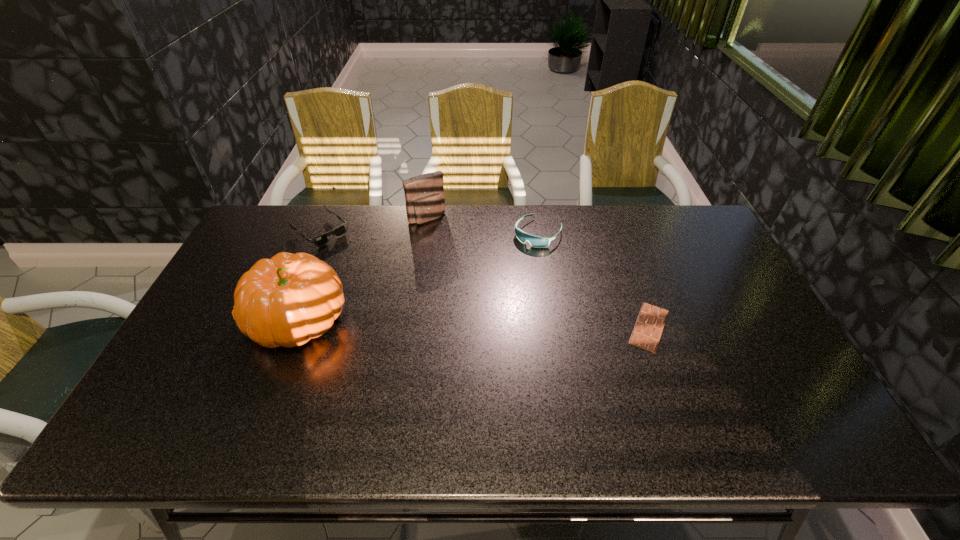
The image size is (960, 540). What are the coordinates of `vacant space at the far left corner of the desktop` in the screenshot? It's located at (266, 237).

In the image, there is a desktop. Identify the location of free space at the far right corner. (682, 226).

Where is `vacant region at the near right corner`? The image size is (960, 540). vacant region at the near right corner is located at coordinates (800, 381).

Find the location of a particular element. This screenshot has width=960, height=540. free space between the fourth tallest object and the fourth shortest object is located at coordinates (373, 225).

You are a GUI agent. You are given a task and a screenshot of the screen. Output one action in this format:
    pyautogui.click(x=<x>, y=<y>)
    Task: Click on the vacant space that's between the pumpkin and the chocolate bar
    
    Given the screenshot: What is the action you would take?
    pyautogui.click(x=473, y=323)

At what (x,y) coordinates should I click in order to perform the action: click on unoccupied position between the sunglasses and the third object from left to right. Please return your answer as a coordinate pair (x, y). The width and height of the screenshot is (960, 540). Looking at the image, I should click on pyautogui.click(x=373, y=225).

Locate an element on the screen. Image resolution: width=960 pixels, height=540 pixels. free space that is in between the pumpkin and the fourth object from left to right is located at coordinates (419, 276).

Find the location of `vacant space in between the shortest object and the second shortest object`. vacant space in between the shortest object and the second shortest object is located at coordinates (485, 279).

This screenshot has width=960, height=540. In order to click on vacant space that's between the second tallest object and the pumpkin in this screenshot , I will do coord(363,268).

The height and width of the screenshot is (540, 960). What are the coordinates of `free space between the third object from right to left and the shortest object` in the screenshot? It's located at (538, 273).